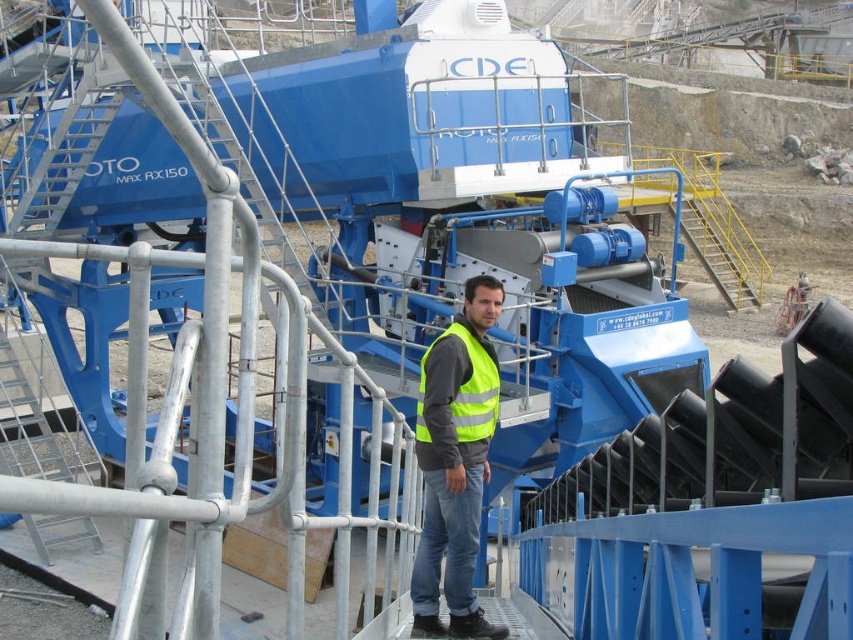
Who is more distant from viewer, (x=410, y=573) or (x=495, y=424)?

Positioned behind is point (x=410, y=573).

Is high visibility yellow vest at center below yellow reflective safety vest at center?

Correct, high visibility yellow vest at center is located below yellow reflective safety vest at center.

Measure the distance between high visibility yellow vest at center and camera.

high visibility yellow vest at center is 7.76 meters away from camera.

Where is `high visibility yellow vest at center`? The height and width of the screenshot is (640, 853). high visibility yellow vest at center is located at coordinates (456, 461).